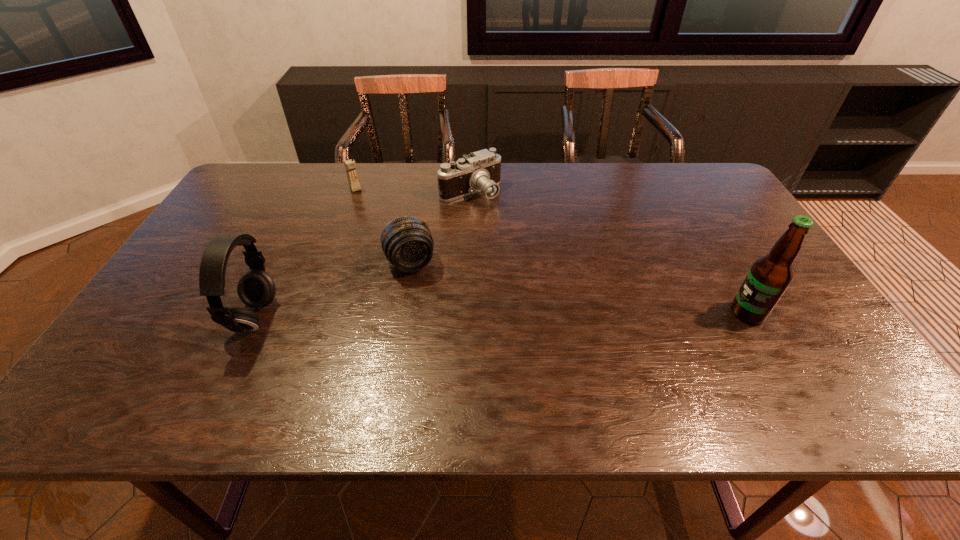
Find the location of a particular element. This screenshot has width=960, height=540. free space located 0.200m at the lens of the camera is located at coordinates (511, 244).

You are a GUI agent. You are given a task and a screenshot of the screen. Output one action in this format:
    pyautogui.click(x=<x>, y=<y>)
    Task: Click on the free spot located at the lens of the camera
    Image resolution: width=960 pixels, height=540 pixels.
    Given the screenshot: What is the action you would take?
    pyautogui.click(x=514, y=247)

Where is `free spot located 0.330m at the lens of the camera`? The height and width of the screenshot is (540, 960). free spot located 0.330m at the lens of the camera is located at coordinates click(532, 272).

Locate an element on the screen. The image size is (960, 540). cellular telephone at the far edge is located at coordinates (350, 166).

I want to click on camera that is at the far edge, so click(479, 171).

This screenshot has height=540, width=960. Identify the location of object at the near edge. (256, 289).

The height and width of the screenshot is (540, 960). In order to click on object present at the right edge in this screenshot , I will do `click(769, 277)`.

The image size is (960, 540). What are the coordinates of `free point at the far edge` in the screenshot? It's located at (350, 194).

In the image, there is a desktop. Where is `vacant space at the near edge`? vacant space at the near edge is located at coordinates (531, 355).

Image resolution: width=960 pixels, height=540 pixels. Identify the location of vacant point at the left edge. (188, 337).